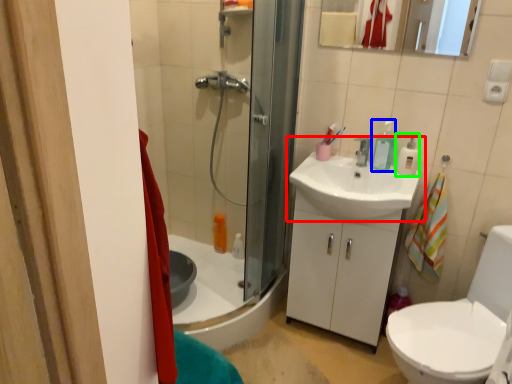
Question: Which object is positioned closest to sink (highlighted by a red box)? Select from toiletry (highlighted by a blue box) and soap dispenser (highlighted by a green box).

Choices:
 (A) toiletry
 (B) soap dispenser

Answer: (A)